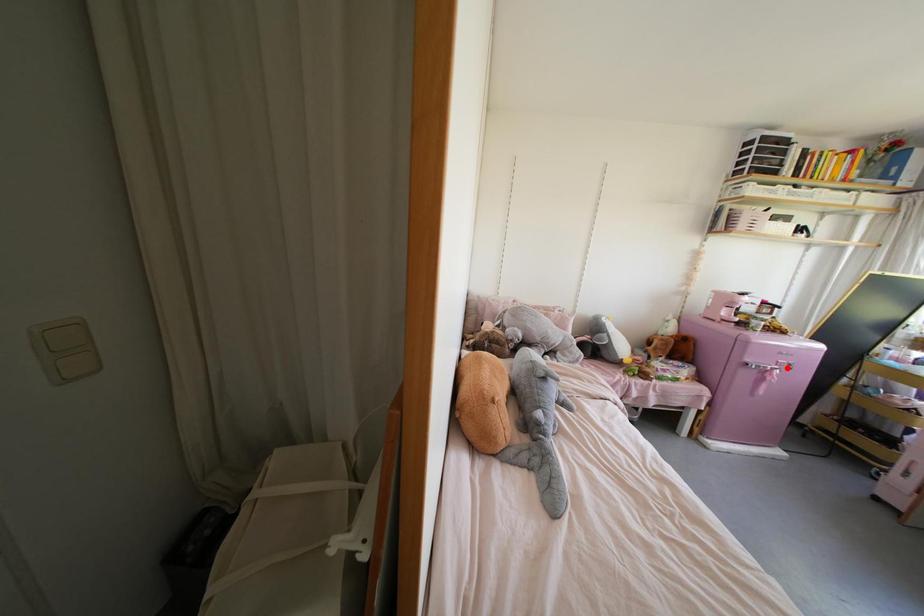
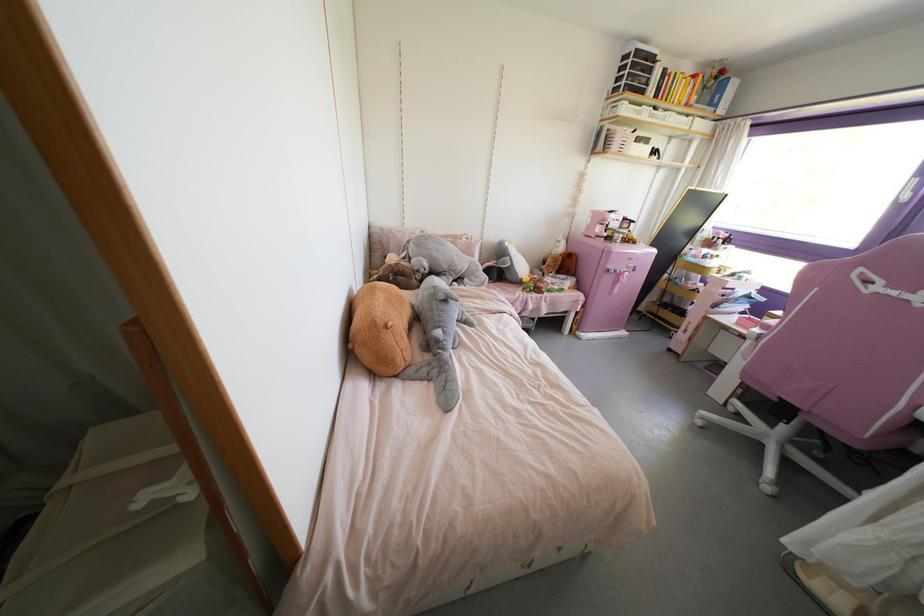
Question: I am providing you with two images of the same scene from different viewpoints. A red point is shown in image1. For the corresponding object point in image2, is it positioned nearer or farther from the camera?

Choices:
 (A) Nearer
 (B) Farther

Answer: (A)